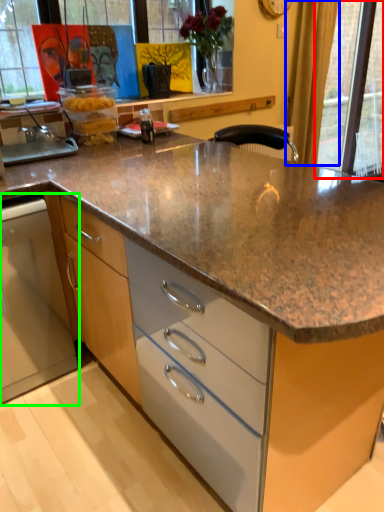
Question: Which object is positioned closest to glass door (highlighted by a red box)? Select from curtain (highlighted by a blue box) and home appliance (highlighted by a green box).

Choices:
 (A) curtain
 (B) home appliance

Answer: (A)